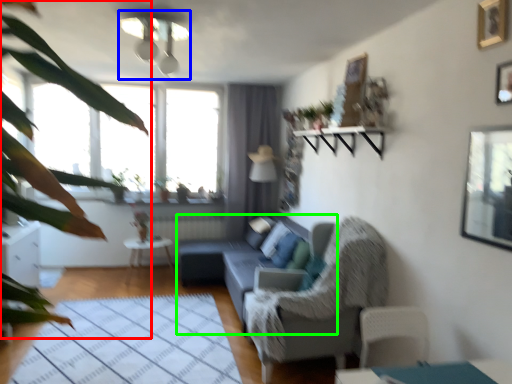
Question: Based on their relative distances, which object is nearer to vegetation (highlighted by a red box)? Choose from light fixture (highlighted by a blue box) and studio couch (highlighted by a green box).

Choices:
 (A) light fixture
 (B) studio couch

Answer: (A)